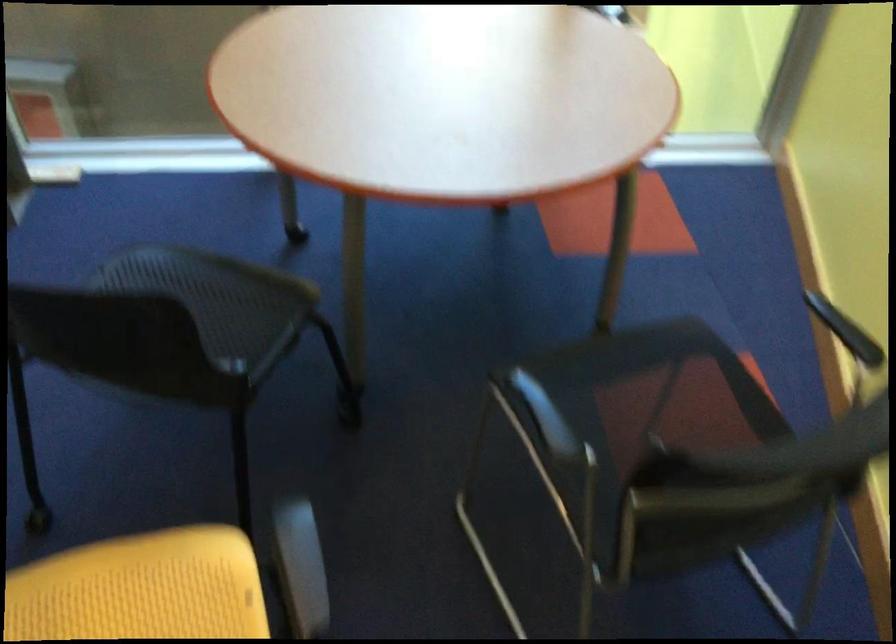
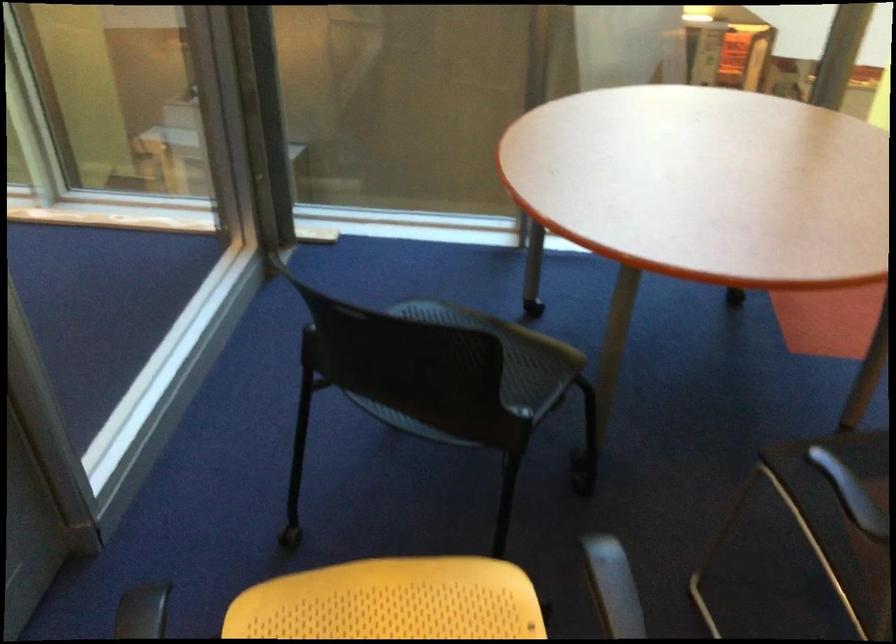
Question: The camera is either moving clockwise (left) or counter-clockwise (right) around the object. The first image is from the beginning of the video and the second image is from the end. Is the camera moving left or right when shooting the video?

Choices:
 (A) Left
 (B) Right

Answer: (B)